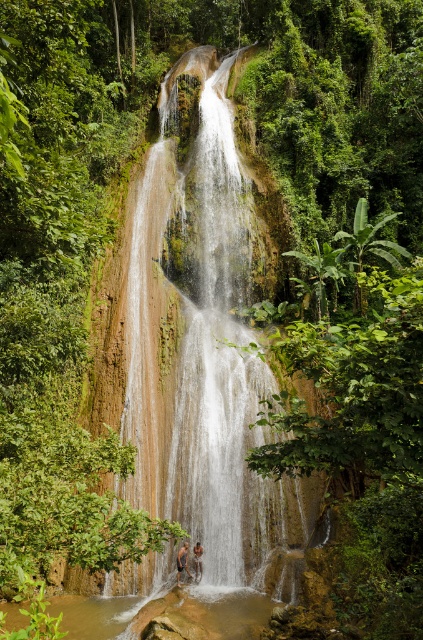
Can you confirm if green mossy rock at center is positioned to the right of brown textured hair at lower center?

Indeed, green mossy rock at center is positioned on the right side of brown textured hair at lower center.

Is point (145, 428) closer to camera compared to point (176, 561)?

That is False.

Which is behind, point (137, 236) or point (181, 557)?

The point (137, 236) is more distant.

This screenshot has height=640, width=423. I want to click on green mossy rock at center, so click(x=225, y=385).

Is brown textured hair at lower center bigger than brown textured skin at center?

Indeed, brown textured hair at lower center has a larger size compared to brown textured skin at center.

Which is more to the left, brown textured hair at lower center or brown textured skin at center?

brown textured hair at lower center

Does point (184, 547) come behind point (194, 557)?

No, it is not.

Locate an element on the screen. brown textured hair at lower center is located at coordinates (181, 561).

This screenshot has width=423, height=640. Find the location of `green mossy rock at center`. green mossy rock at center is located at coordinates (225, 385).

This screenshot has height=640, width=423. I want to click on green mossy rock at center, so click(x=225, y=385).

Identify the location of green mossy rock at center. (225, 385).